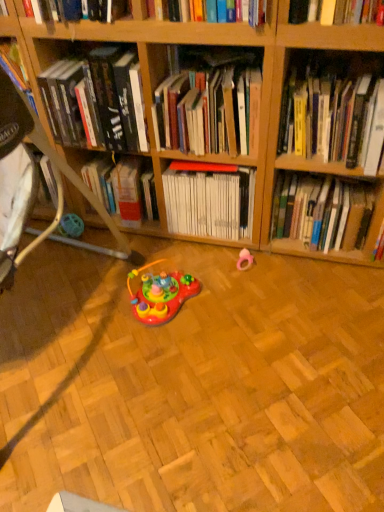
Question: Is white matte book at center, which appears as the third book when viewed from the left, at the left side of hardcover books at center, the 4th book from the right?

Choices:
 (A) no
 (B) yes

Answer: (A)

Question: From a real-world perspective, is white matte book at center, which is the 3th book in right-to-left order, located higher than hardcover books at center, the 4th book from the right?

Choices:
 (A) no
 (B) yes

Answer: (A)

Question: Does white matte book at center, which is the 3th book in right-to-left order, have a larger size compared to hardcover books at center, the 4th book from the right?

Choices:
 (A) no
 (B) yes

Answer: (B)

Question: Is white matte book at center, which is the 3th book in right-to-left order, outside of hardcover books at center, positioned as the second book in left-to-right order?

Choices:
 (A) yes
 (B) no

Answer: (A)

Question: Is white matte book at center, which appears as the third book when viewed from the left, wider than hardcover books at center, the 4th book from the right?

Choices:
 (A) yes
 (B) no

Answer: (B)

Question: Is white matte book at center, which is the 3th book in right-to-left order, to the right of hardcover books at center, the 4th book from the right, from the viewer's perspective?

Choices:
 (A) no
 (B) yes

Answer: (B)

Question: Considering the relative positions of pink rubber ring at center, the 2th toy when ordered from left to right, and white matte book at center, which is the 3th book in right-to-left order, in the image provided, is pink rubber ring at center, the 2th toy when ordered from left to right, to the right of white matte book at center, which is the 3th book in right-to-left order, from the viewer's perspective?

Choices:
 (A) no
 (B) yes

Answer: (B)

Question: Are pink rubber ring at center, which is the first toy in right-to-left order, and white matte book at center, which appears as the third book when viewed from the left, far apart?

Choices:
 (A) no
 (B) yes

Answer: (A)

Question: Does pink rubber ring at center, the 2th toy when ordered from left to right, have a greater height compared to white matte book at center, which is the 3th book in right-to-left order?

Choices:
 (A) no
 (B) yes

Answer: (A)

Question: Is pink rubber ring at center, the 2th toy when ordered from left to right, bigger than white matte book at center, which appears as the third book when viewed from the left?

Choices:
 (A) no
 (B) yes

Answer: (A)

Question: Is pink rubber ring at center, the 2th toy when ordered from left to right, closer to the viewer compared to white matte book at center, which appears as the third book when viewed from the left?

Choices:
 (A) no
 (B) yes

Answer: (A)

Question: Does pink rubber ring at center, the 2th toy when ordered from left to right, have a lesser width compared to white matte book at center, which appears as the third book when viewed from the left?

Choices:
 (A) no
 (B) yes

Answer: (B)

Question: From the image's perspective, is hardcover book at center, marked as the fifth book in a left-to-right arrangement, on hardcover book at upper center, the 5th book when ordered from right to left?

Choices:
 (A) yes
 (B) no

Answer: (B)